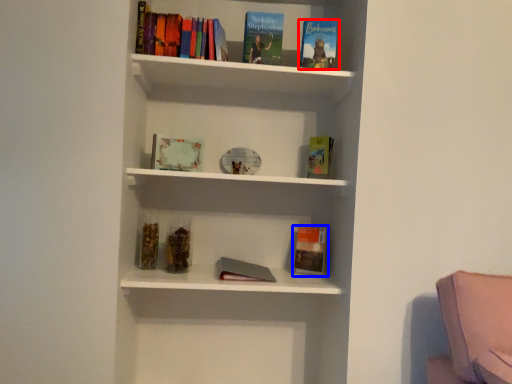
Question: Which point is closer to the camera, book (highlighted by a red box) or paperback book (highlighted by a blue box)?

Choices:
 (A) book
 (B) paperback book

Answer: (A)